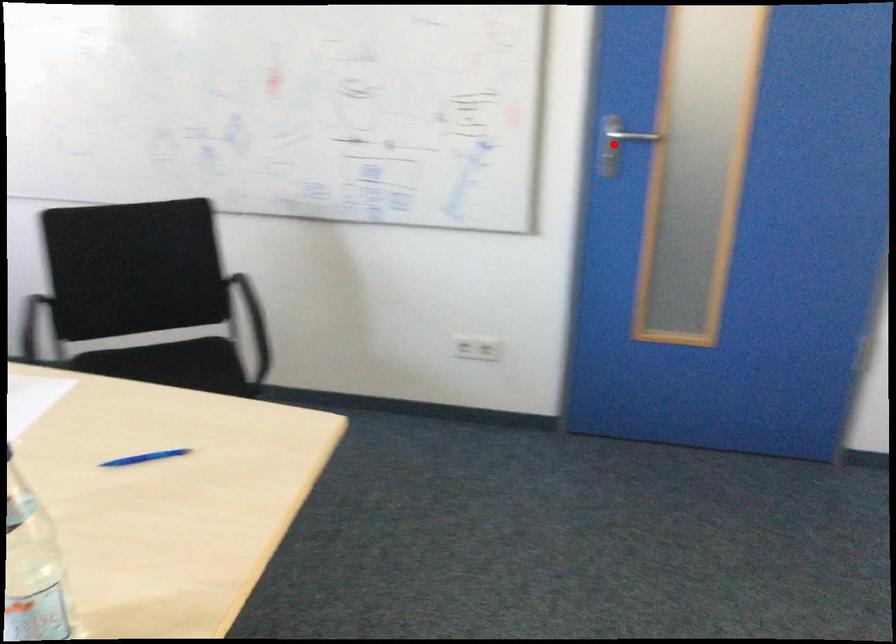
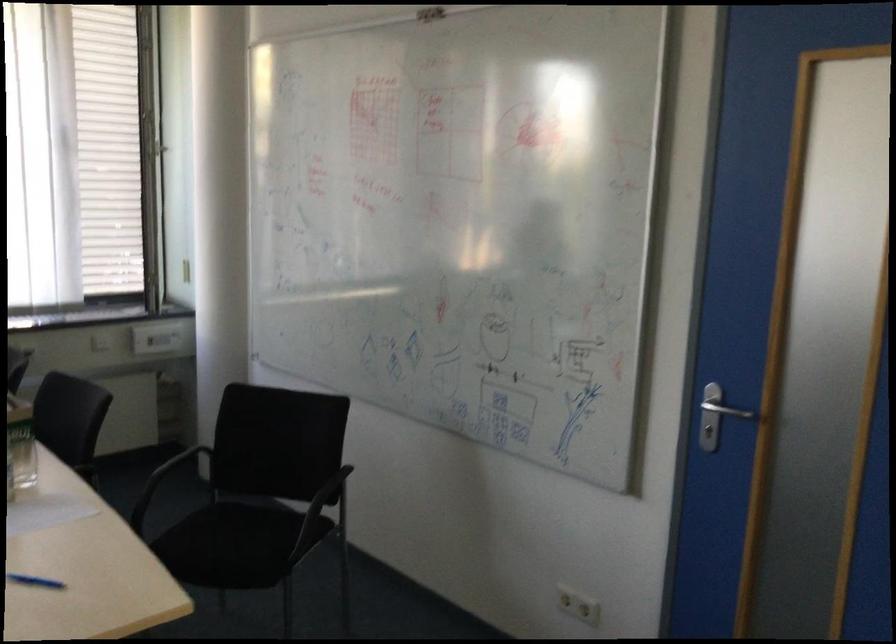
Question: I am providing you with two images of the same scene from different viewpoints. In image1, a red point is highlighted. Considering the same 3D point in image2, which of the following is correct?

Choices:
 (A) It is closer
 (B) It is farther

Answer: (A)